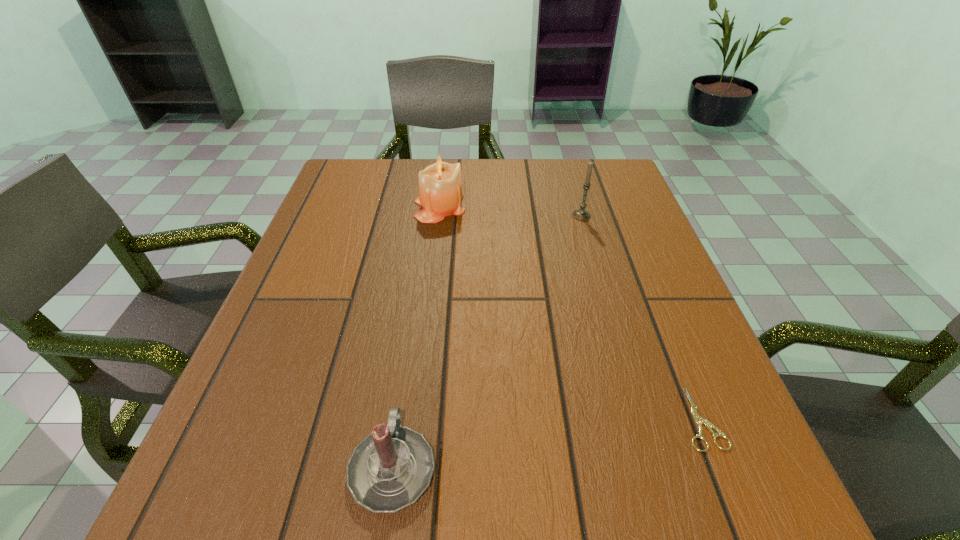
This screenshot has width=960, height=540. What are the coordinates of `the rightmost candle` in the screenshot? It's located at (580, 214).

Locate an element on the screen. The width and height of the screenshot is (960, 540). the third tallest object is located at coordinates (391, 468).

Image resolution: width=960 pixels, height=540 pixels. I want to click on the nearest candle, so click(391, 468).

The height and width of the screenshot is (540, 960). What are the coordinates of `the shortest object` in the screenshot? It's located at (699, 420).

Locate an element on the screen. The width and height of the screenshot is (960, 540). the rightmost object is located at coordinates (699, 420).

Identify the location of free spot located 0.370m on the front of the rightmost candle. pyautogui.click(x=619, y=345).

Where is `vacant space located on the side of the nearest candle with the handle loop`? The width and height of the screenshot is (960, 540). vacant space located on the side of the nearest candle with the handle loop is located at coordinates (409, 357).

In order to click on free space located on the side of the nearest candle with the handle loop in this screenshot , I will do `click(420, 281)`.

Find the location of `vacant space located on the side of the nearest candle with the handle loop`. vacant space located on the side of the nearest candle with the handle loop is located at coordinates (410, 348).

Locate an element on the screen. The width and height of the screenshot is (960, 540). free space located on the back of the rightmost object is located at coordinates (634, 249).